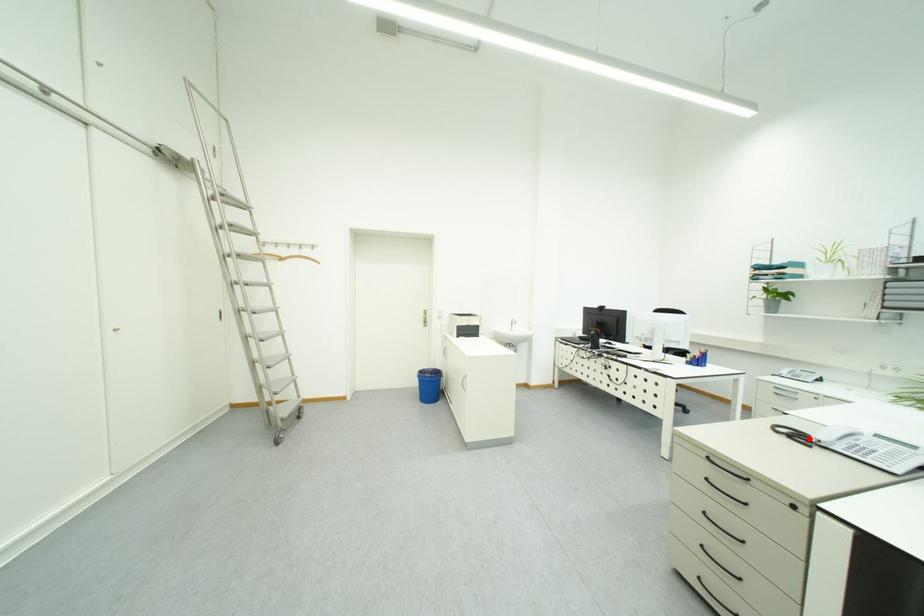
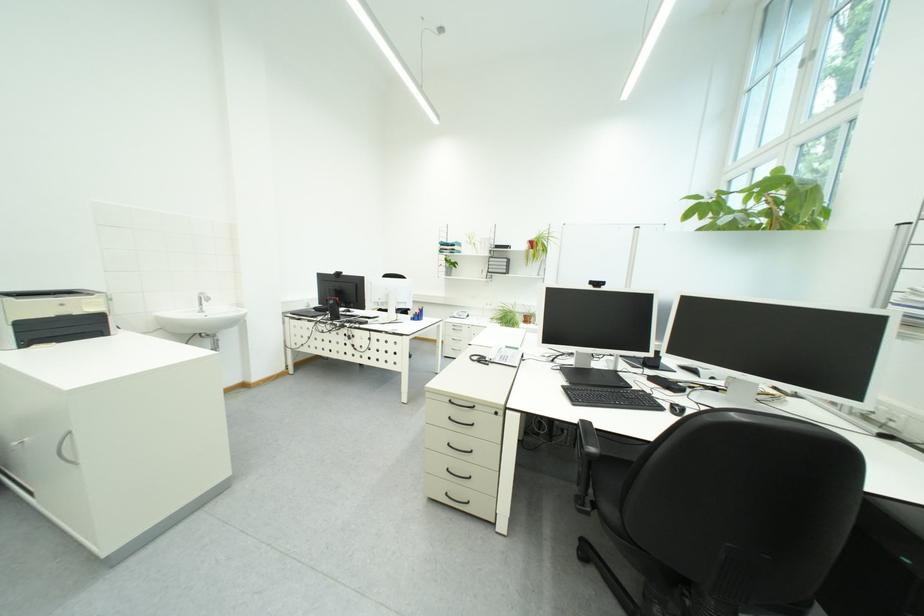
Find the pixel in the second image that matches the highlighted location in the first image.

(492, 362)